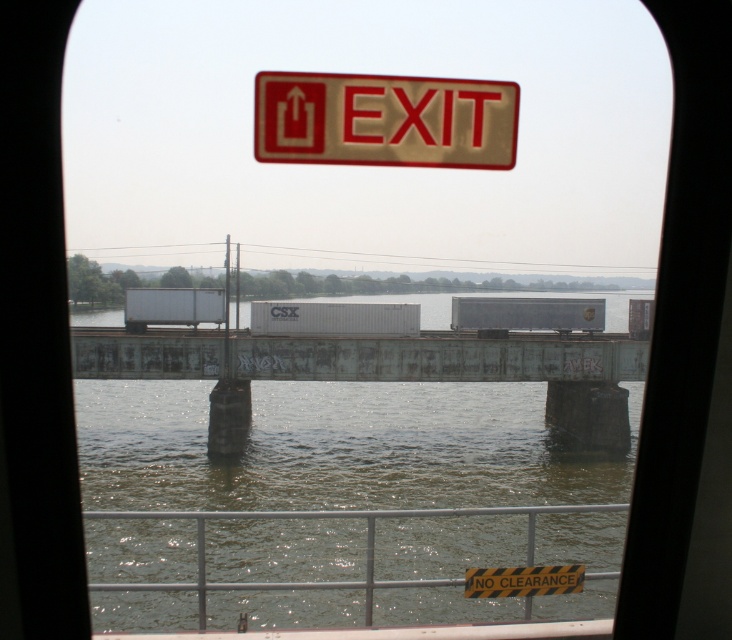
Question: Is rusty metal bridge at center positioned behind gold textured exit sign at upper center?

Choices:
 (A) yes
 (B) no

Answer: (A)

Question: Which point appears farthest from the camera in this image?

Choices:
 (A) (239, 394)
 (B) (498, 138)

Answer: (A)

Question: Which of the following is the closest to the observer?

Choices:
 (A) (346, 364)
 (B) (451, 116)

Answer: (B)

Question: Does rusty metal bridge at center have a greater width compared to gold textured exit sign at upper center?

Choices:
 (A) yes
 (B) no

Answer: (A)

Question: Is rusty metal bridge at center further to camera compared to gold textured exit sign at upper center?

Choices:
 (A) yes
 (B) no

Answer: (A)